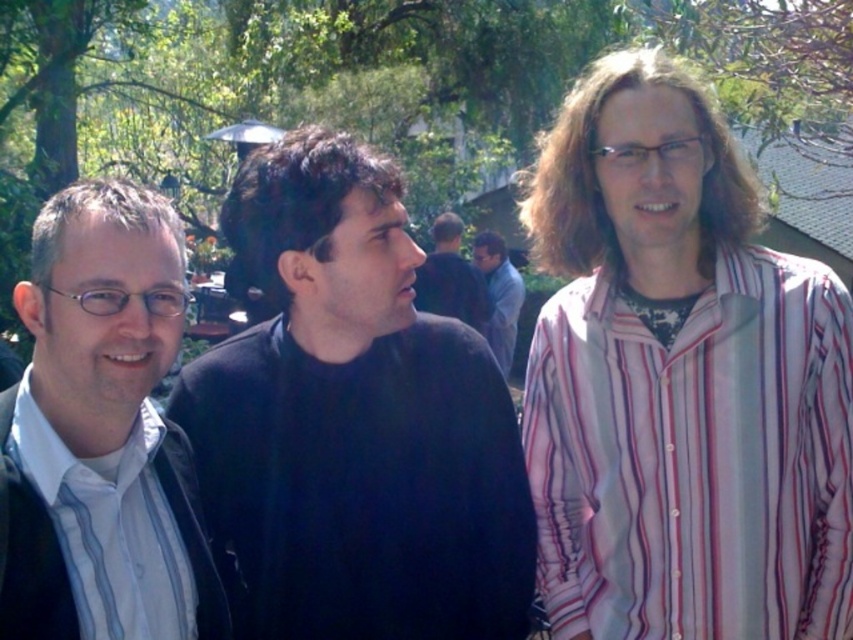
Is black matte sweater at center behind dark blue sweater at center?

No, it is in front of dark blue sweater at center.

Does black matte sweater at center appear under dark blue sweater at center?

Yes, black matte sweater at center is below dark blue sweater at center.

You are a GUI agent. You are given a task and a screenshot of the screen. Output one action in this format:
    pyautogui.click(x=<x>, y=<y>)
    Task: Click on the black matte sweater at center
    
    Given the screenshot: What is the action you would take?
    pyautogui.click(x=352, y=420)

Does white striped shirt at left have a lesser height compared to dark blue sweater at center?

Yes.

Is white striped shirt at left positioned in front of dark blue sweater at center?

Yes, it is.

Between point (73, 572) and point (514, 289), which one is positioned in front?

Point (73, 572) is in front.

Identify the location of white striped shirt at left. (100, 536).

Is striped cotton shirt at right closer to the viewer compared to white striped shirt at left?

No, it is behind white striped shirt at left.

Which of these two, striped cotton shirt at right or white striped shirt at left, stands taller?

With more height is striped cotton shirt at right.

Where is `striped cotton shirt at right`? striped cotton shirt at right is located at coordinates (695, 456).